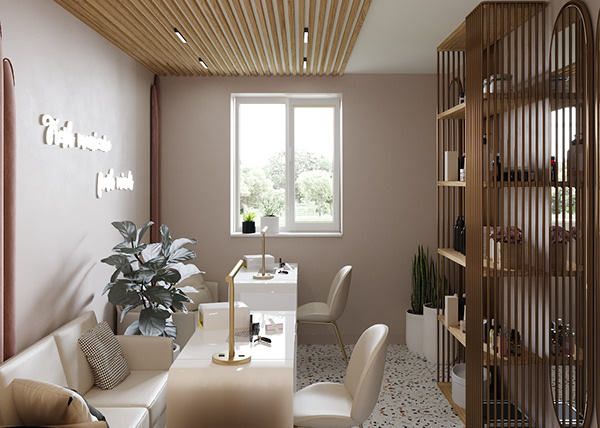
You are a GUI agent. You are given a task and a screenshot of the screen. Output one action in this format:
    pyautogui.click(x=<x>, y=<y>)
    Task: Click on the chair
    
    Given the screenshot: What is the action you would take?
    point(335,398), point(316,304), point(188,321)